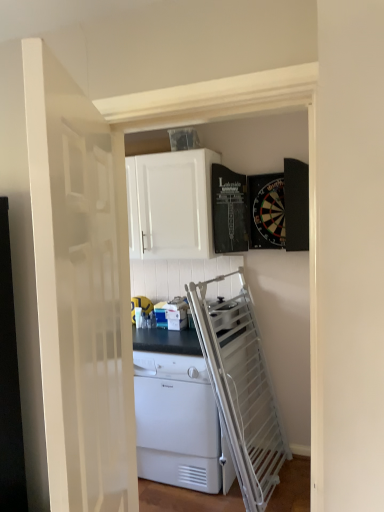
What do you see at coordinates (140, 306) in the screenshot? The height and width of the screenshot is (512, 384). I see `yellow rubber ball at center` at bounding box center [140, 306].

Locate an element on the screen. Image resolution: width=384 pixels, height=512 pixels. white matte cabinet at upper center is located at coordinates (170, 204).

What do you see at coordinates (170, 204) in the screenshot?
I see `white matte cabinet at upper center` at bounding box center [170, 204].

Describe the element at coordinates (80, 290) in the screenshot. I see `white glossy door at center` at that location.

What are the coordinates of `yellow rubber ball at center` in the screenshot? It's located at coord(140,306).

Is white plastic dishwasher at center next to white glossy door at center?

white plastic dishwasher at center is not next to white glossy door at center, and they're not touching.

Is white plastic dishwasher at center looking in the opposite direction of white glossy door at center?

No, white glossy door at center is not at the back of white plastic dishwasher at center.

In terms of width, does white plastic dishwasher at center look wider or thinner when compared to white glossy door at center?

white plastic dishwasher at center is wider than white glossy door at center.

Can you confirm if white plastic dishwasher at center is smaller than white glossy door at center?

No, white plastic dishwasher at center is not smaller than white glossy door at center.

From a real-world perspective, between white matte cabinet at upper center and yellow rubber ball at center, who is vertically higher?

white matte cabinet at upper center, from a real-world perspective.

Considering the positions of objects white matte cabinet at upper center and yellow rubber ball at center in the image provided, who is more to the right, white matte cabinet at upper center or yellow rubber ball at center?

Positioned to the right is white matte cabinet at upper center.

Image resolution: width=384 pixels, height=512 pixels. I want to click on appliance behind the white matte cabinet at upper center, so click(140, 306).

Is white matte cabinet at upper center thinner than yellow rubber ball at center?

No, white matte cabinet at upper center is not thinner than yellow rubber ball at center.

Is white glossy door at center positioned behind white plastic dishwasher at center?

No, it is not.

In terms of width, does white glossy door at center look wider or thinner when compared to white plastic dishwasher at center?

Clearly, white glossy door at center has less width compared to white plastic dishwasher at center.

Is white glossy door at center in contact with white plastic dishwasher at center?

They are not placed beside each other.

Is white glossy door at center bigger than white matte cabinet at upper center?

Incorrect, white glossy door at center is not larger than white matte cabinet at upper center.

From a real-world perspective, is white glossy door at center beneath white matte cabinet at upper center?

→ Yes, from a real-world perspective, white glossy door at center is below white matte cabinet at upper center.

Between white glossy door at center and white matte cabinet at upper center, which one has less height?

white matte cabinet at upper center is shorter.

From the image's perspective, which is above, white glossy door at center or white matte cabinet at upper center?

white matte cabinet at upper center.

Is yellow rubber ball at center shorter than white matte cabinet at upper center?

Correct, yellow rubber ball at center is not as tall as white matte cabinet at upper center.

From a real-world perspective, is yellow rubber ball at center physically below white matte cabinet at upper center?

Yes.

From the picture: Considering the sizes of yellow rubber ball at center and white matte cabinet at upper center in the image, is yellow rubber ball at center wider or thinner than white matte cabinet at upper center?

yellow rubber ball at center is thinner than white matte cabinet at upper center.

Does point (135, 301) appear closer or farther from the camera than point (211, 221)?

Point (135, 301) is farther from the camera than point (211, 221).

From a real-world perspective, which is physically below, white plastic dishwasher at center or yellow rubber ball at center?

white plastic dishwasher at center is physically lower.

Is white plastic dishwasher at center positioned before yellow rubber ball at center?

Yes, the depth of white plastic dishwasher at center is less than that of yellow rubber ball at center.

From the image's perspective, is white plastic dishwasher at center located beneath yellow rubber ball at center?

Correct, white plastic dishwasher at center appears lower than yellow rubber ball at center in the image.

From a real-world perspective, is white matte cabinet at upper center above or below white glossy door at center?

In terms of real-world spatial position, white matte cabinet at upper center is above white glossy door at center.

Is white matte cabinet at upper center shorter than white glossy door at center?

Indeed, white matte cabinet at upper center has a lesser height compared to white glossy door at center.

How much distance is there between white matte cabinet at upper center and white glossy door at center?

white matte cabinet at upper center is 4.75 feet away from white glossy door at center.

At what (x,y) coordinates should I click in order to perform the action: click on door above the white plastic dishwasher at center (from the image's perspective). Please return your answer as a coordinate pair (x, y). Image resolution: width=384 pixels, height=512 pixels. Looking at the image, I should click on (80, 290).

Where is `cabinetry on the right of yellow rubber ball at center`? This screenshot has height=512, width=384. cabinetry on the right of yellow rubber ball at center is located at coordinates (170, 204).

Considering their positions, is white matte cabinet at upper center positioned further to white glossy door at center than white plastic dishwasher at center?

Among the two, white matte cabinet at upper center is located further to white glossy door at center.

Looking at the image, which one is located closer to white matte cabinet at upper center, yellow rubber ball at center or white plastic dishwasher at center?

Based on the image, yellow rubber ball at center appears to be nearer to white matte cabinet at upper center.

Based on their spatial positions, is white plastic dishwasher at center or yellow rubber ball at center closer to white glossy door at center?

white plastic dishwasher at center is closer to white glossy door at center.

Estimate the real-world distances between objects in this image. Which object is closer to white glossy door at center, white plastic dishwasher at center or white matte cabinet at upper center?

Among the two, white plastic dishwasher at center is located nearer to white glossy door at center.

Based on the photo, considering their positions, is white matte cabinet at upper center positioned closer to yellow rubber ball at center than white glossy door at center?

Among the two, white matte cabinet at upper center is located nearer to yellow rubber ball at center.

Looking at the image, which one is located closer to yellow rubber ball at center, white matte cabinet at upper center or white plastic dishwasher at center?

Based on the image, white matte cabinet at upper center appears to be nearer to yellow rubber ball at center.

From the image, which object appears to be nearer to white plastic dishwasher at center, white matte cabinet at upper center or white glossy door at center?

white matte cabinet at upper center.

From the image, which object appears to be nearer to white plastic dishwasher at center, white glossy door at center or white matte cabinet at upper center?

white matte cabinet at upper center is positioned closer to the anchor white plastic dishwasher at center.

This screenshot has height=512, width=384. In order to click on home appliance located between white glossy door at center and white matte cabinet at upper center in the depth direction in this screenshot , I will do `click(179, 424)`.

Image resolution: width=384 pixels, height=512 pixels. I want to click on home appliance located between white glossy door at center and yellow rubber ball at center in the depth direction, so pos(179,424).

At what (x,y) coordinates should I click in order to perform the action: click on cabinetry positioned between white glossy door at center and yellow rubber ball at center from near to far. Please return your answer as a coordinate pair (x, y). Image resolution: width=384 pixels, height=512 pixels. Looking at the image, I should click on 170,204.

Locate an element on the screen. The height and width of the screenshot is (512, 384). appliance between white matte cabinet at upper center and white plastic dishwasher at center in the vertical direction is located at coordinates (140, 306).